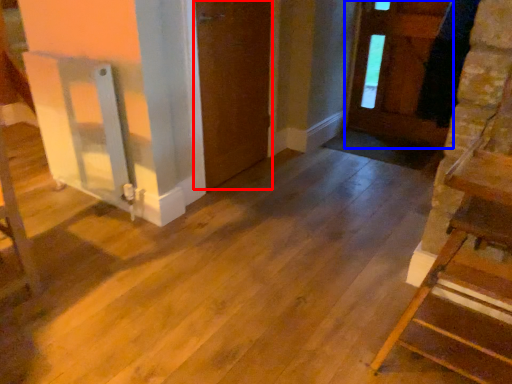
Question: Which object is further to the camera taking this photo, door (highlighted by a red box) or door (highlighted by a blue box)?

Choices:
 (A) door
 (B) door

Answer: (B)